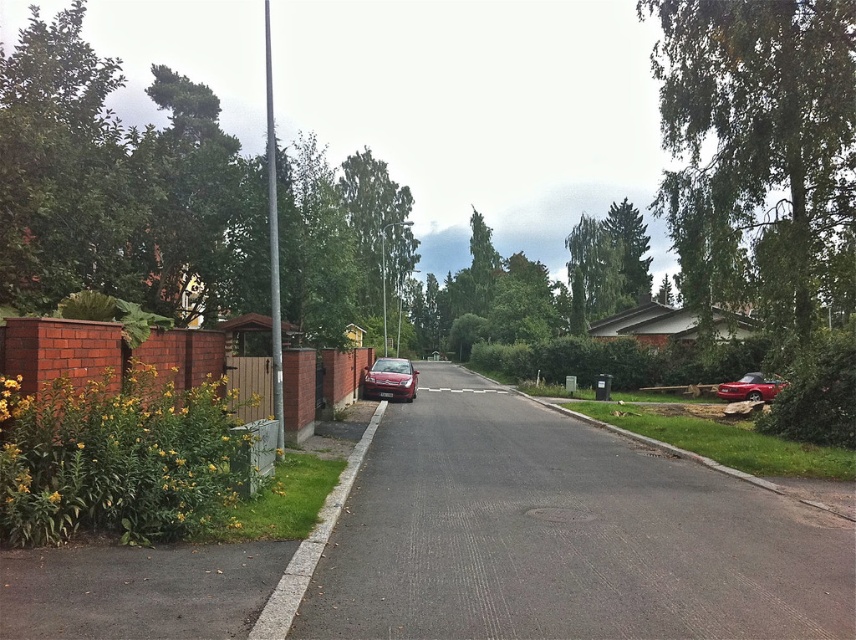
Can you confirm if glossy red car at center is positioned to the right of satin silver sedan at center?

Yes, glossy red car at center is to the right of satin silver sedan at center.

Identify the location of glossy red car at center. (562, 536).

Identify the location of glossy red car at center. The height and width of the screenshot is (640, 856). (562, 536).

Which is above, glossy red car at center or glossy metallic car at right?

glossy metallic car at right

What do you see at coordinates (562, 536) in the screenshot?
I see `glossy red car at center` at bounding box center [562, 536].

Identify the location of glossy red car at center. (562, 536).

Can you confirm if satin silver sedan at center is positioned to the right of glossy metallic car at right?

No, satin silver sedan at center is not to the right of glossy metallic car at right.

How much distance is there between satin silver sedan at center and glossy metallic car at right?

12.42 meters

This screenshot has height=640, width=856. What do you see at coordinates (390, 380) in the screenshot?
I see `satin silver sedan at center` at bounding box center [390, 380].

Identify the location of satin silver sedan at center. The height and width of the screenshot is (640, 856). (390, 380).